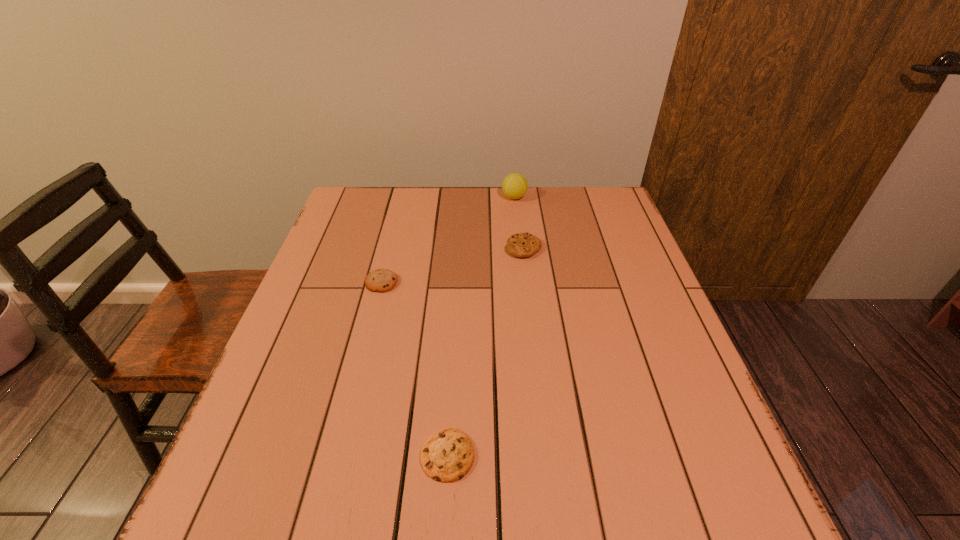
Identify the location of empty location between the leftmost object and the farthest object. (448, 240).

Locate an element on the screen. Image resolution: width=960 pixels, height=540 pixels. blank region between the second shortest cookie and the third nearest object is located at coordinates (452, 265).

This screenshot has width=960, height=540. Find the location of `object that stands as the third closest to the leftmost cookie`. object that stands as the third closest to the leftmost cookie is located at coordinates (514, 186).

Locate which object is the closest to the tallest object. Please provide its 2D coordinates. Your answer should be formatted as a tuple, i.e. [(x, y)], where the tuple contains the x and y coordinates of a point satisfying the conditions above.

[(521, 245)]

Locate which cookie ranks second in proximity to the third nearest object. Please provide its 2D coordinates. Your answer should be formatted as a tuple, i.e. [(x, y)], where the tuple contains the x and y coordinates of a point satisfying the conditions above.

[(446, 456)]

Identify the location of cookie that is the closest to the nearest object. (381, 280).

Where is `free point that satisfies the following two spatial constraints: 1. on the front side of the shortest object; 2. on the right side of the leftmost cookie`? The image size is (960, 540). free point that satisfies the following two spatial constraints: 1. on the front side of the shortest object; 2. on the right side of the leftmost cookie is located at coordinates (338, 455).

I want to click on free spot that satisfies the following two spatial constraints: 1. on the back side of the shortest object; 2. on the right side of the second tallest object, so click(460, 248).